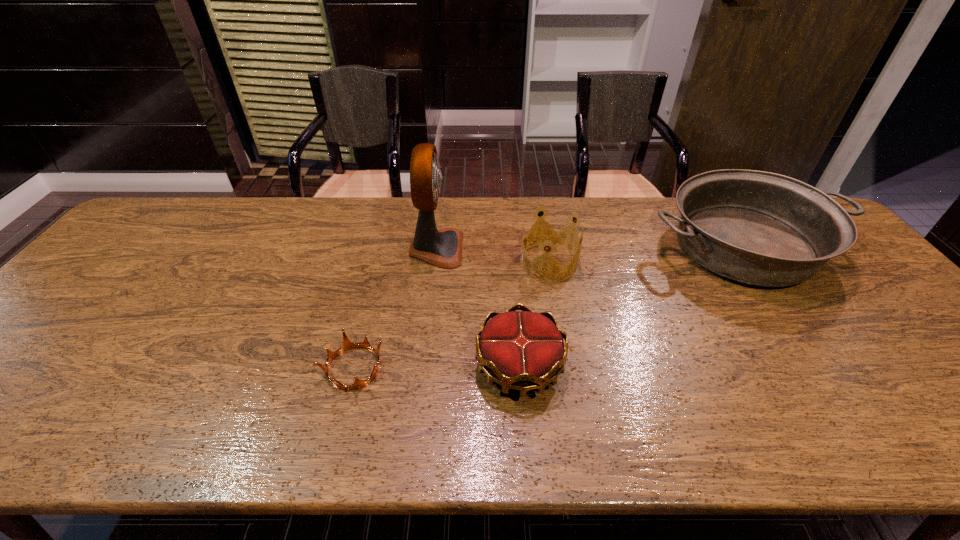
Image resolution: width=960 pixels, height=540 pixels. In order to click on the fourth object from right to left in this screenshot , I will do `click(443, 248)`.

What are the coordinates of `the tallest object` in the screenshot? It's located at (443, 248).

Where is `the rightmost object`? This screenshot has height=540, width=960. the rightmost object is located at coordinates (760, 228).

Identify the location of the farthest crown. (552, 236).

The height and width of the screenshot is (540, 960). In order to click on the second tallest crown in this screenshot , I will do `click(524, 350)`.

The width and height of the screenshot is (960, 540). Identify the location of the leftmost crown. (347, 344).

Identify the location of the shortest object. (347, 344).

The image size is (960, 540). What are the coordinates of `free point located on the front-facing side of the fan` in the screenshot? It's located at (560, 248).

Locate an element on the screen. This screenshot has width=960, height=540. free location located 0.180m on the left of the pan is located at coordinates (585, 248).

The height and width of the screenshot is (540, 960). In order to click on vacant space positioned on the right of the farthest crown in this screenshot , I will do `click(682, 262)`.